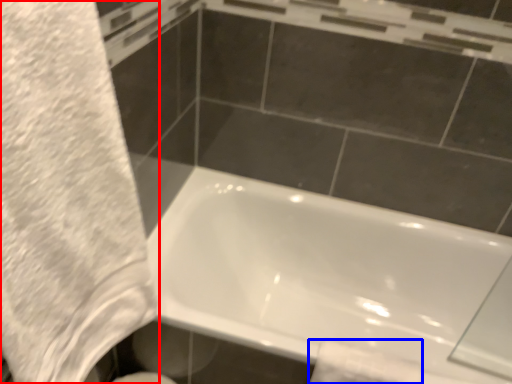
Question: Which object is further to the camera taking this photo, bath towel (highlighted by a red box) or toilet paper (highlighted by a blue box)?

Choices:
 (A) bath towel
 (B) toilet paper

Answer: (B)